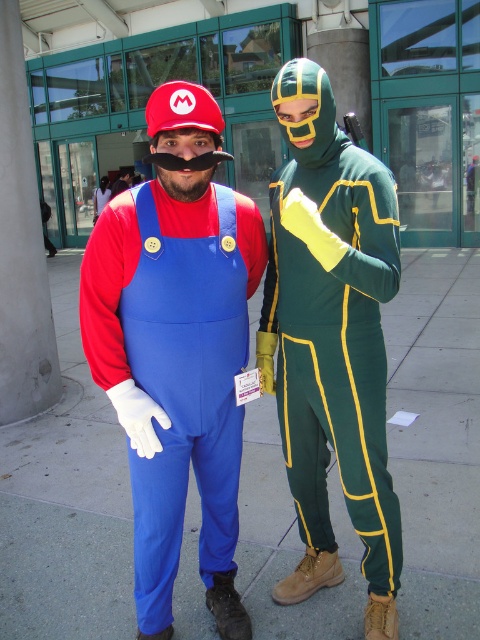
You are organizing a parade float and need to place the matte fabric Mario costume at center and the green matte jumpsuit at center side by side. Based on their widths, which costume should be placed on the left to ensure both fit within the 2.5 meter wide float area?

The matte fabric Mario costume at center is wider than the green matte jumpsuit at center. To fit both within the 2.5 meter float area, place the wider matte fabric Mario costume at center on the left and the narrower green matte jumpsuit at center on the right, ensuring their combined width stays within the 2.5 meters.

You are a costume designer trying to decide which costume to choose for a parade. You have two options displayed in the image. The first is the blue fabric pants at center, and the second is the green matte jumpsuit at center. Based on their lengths, which costume would be more appropriate if you want something that covers more of your body?

The green matte jumpsuit at center is longer than the blue fabric pants at center, so it would be more appropriate if you want a costume that covers more of your body.

You are at a costume party and need to position the blue fabric pants at center and the green matte jumpsuit at center correctly based on their positions in the image. Which object is positioned to the right of the other?

The blue fabric pants at center are to the right of the green matte jumpsuit at center.